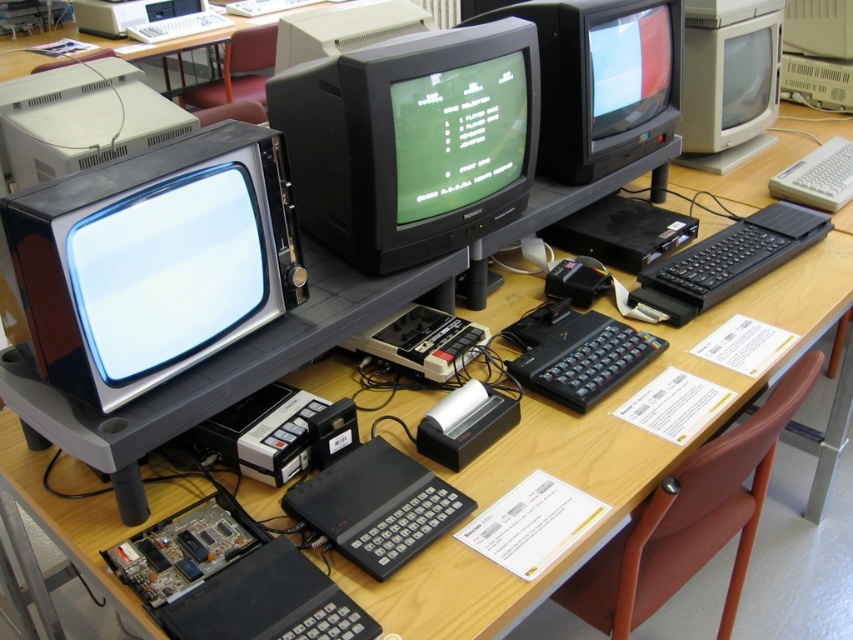
Who is positioned more to the right, matte black monitor at left or matte black monitor at center?

matte black monitor at center

Who is taller, matte black monitor at left or matte black monitor at center?

matte black monitor at left

Locate an element on the screen. matte black monitor at left is located at coordinates (155, 259).

Who is shorter, matte black monitor at left or white plastic keyboard at upper center?

With less height is white plastic keyboard at upper center.

Measure the distance from matte black monitor at left to white plastic keyboard at upper center.

matte black monitor at left is 10.11 feet from white plastic keyboard at upper center.

The width and height of the screenshot is (853, 640). What do you see at coordinates (155, 259) in the screenshot? I see `matte black monitor at left` at bounding box center [155, 259].

Where is `matte black monitor at left`? The height and width of the screenshot is (640, 853). matte black monitor at left is located at coordinates (155, 259).

Does matte black monitor at left have a larger size compared to matte gray desktop computer at upper left?

Yes.

Is matte black monitor at left to the right of matte gray desktop computer at upper left from the viewer's perspective?

Correct, you'll find matte black monitor at left to the right of matte gray desktop computer at upper left.

Is point (238, 282) behind point (140, 132)?

No, (238, 282) is in front of (140, 132).

In order to click on matte black monitor at left in this screenshot , I will do `click(155, 259)`.